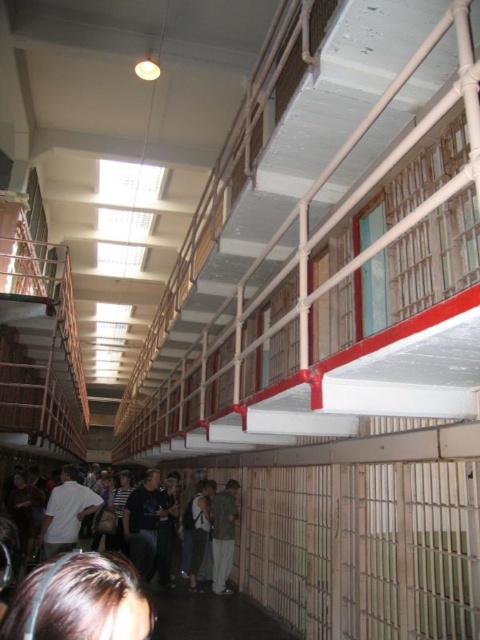
You are a prison guard on patrol in the Alcatraz cell block corridor. You see a dark brown leather jacket at lower left and a green fabric jacket at center. Which jacket is closer to you, the guard?

The dark brown leather jacket at lower left is closer to you because it is in front of the green fabric jacket at center.

You are a security guard in the prison and need to identify the prisoner based on their appearance. If you see a person with brown hair at lower left and a white matte shirt at lower left, which part of their clothing or feature is narrower?

The brown hair at lower left has a lesser width compared to the white matte shirt at lower left, so the brown hair at lower left is narrower.

You are standing in the prison cell block corridor looking towards the cells. There are two points marked in the scene. The first point is at coordinate point (x=80, y=512) and the second point is at coordinate point (x=196, y=497). Which point is closer to you?

Point (x=80, y=512) is closer to the camera than point (x=196, y=497).